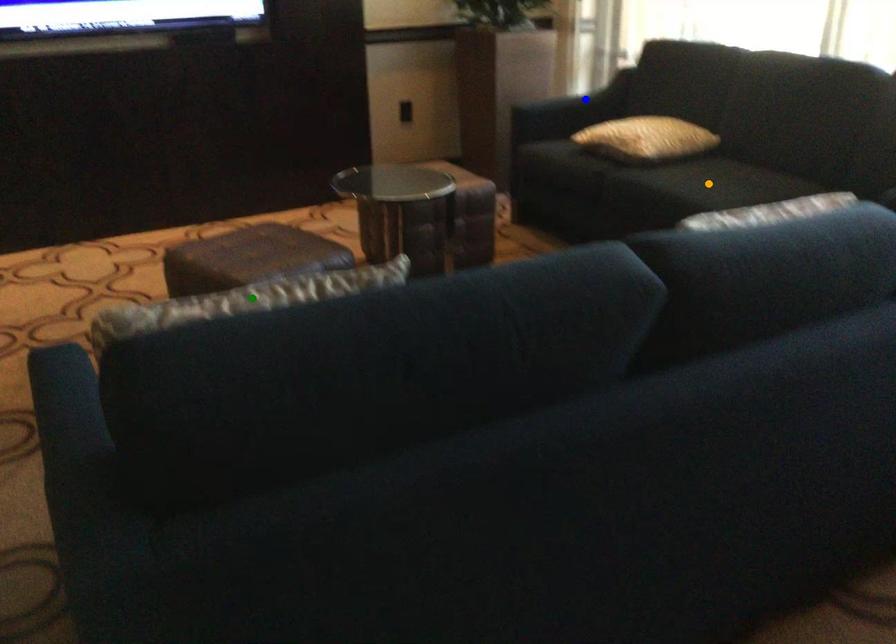
Order these from nearest to farthest:
1. orange point
2. green point
3. blue point

green point < orange point < blue point